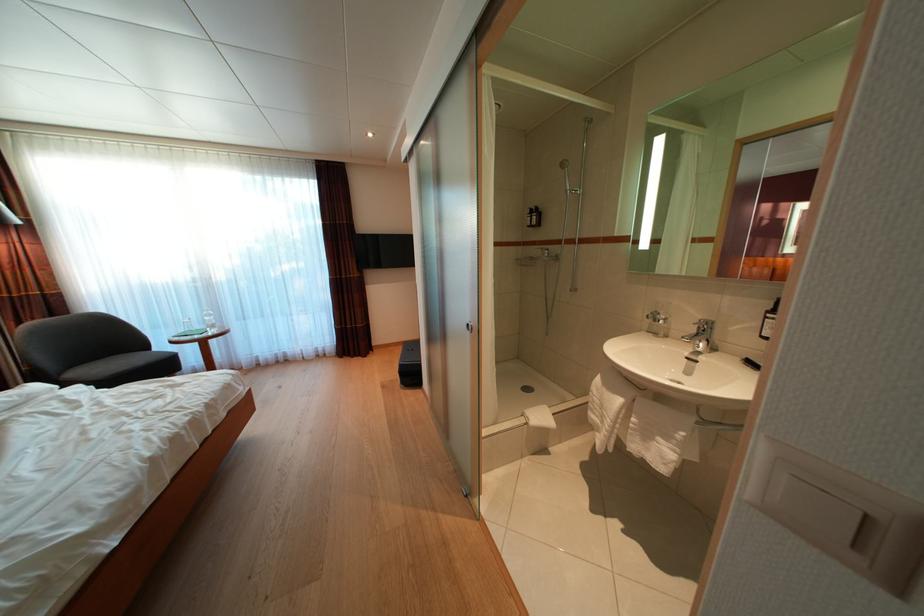
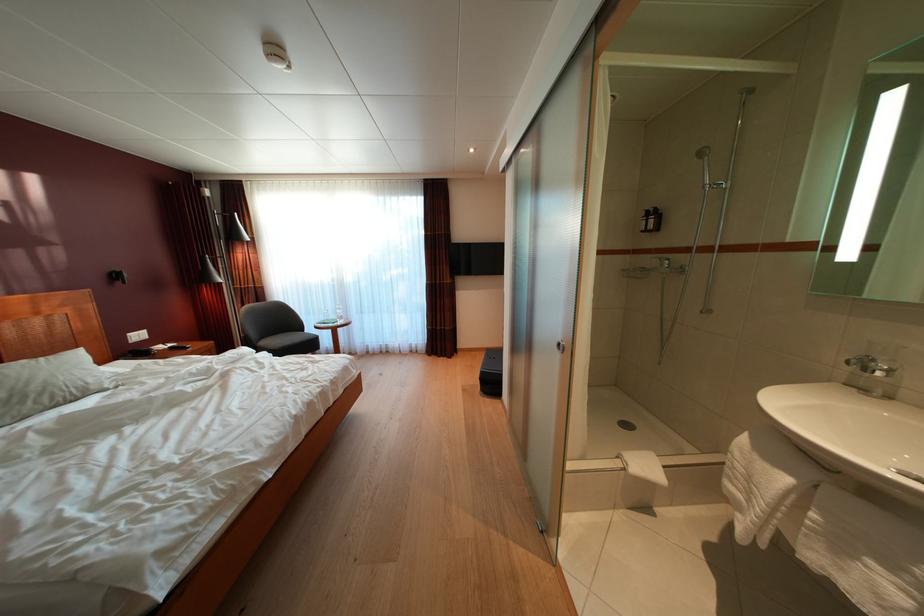
In the second image, find the point that corresponds to (542,224) in the first image.

(660, 227)